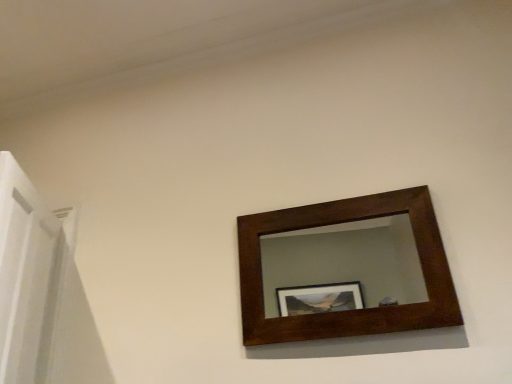
Find the location of a particular element. dark wood/matte picture frame at upper center is located at coordinates (356, 311).

The image size is (512, 384). Describe the element at coordinates (356, 311) in the screenshot. I see `dark wood/matte picture frame at upper center` at that location.

Looking at this image, measure the distance between point [423,316] and camera.

Point [423,316] is 5.53 feet from camera.

This screenshot has height=384, width=512. In order to click on dark wood/matte picture frame at upper center in this screenshot , I will do `click(356, 311)`.